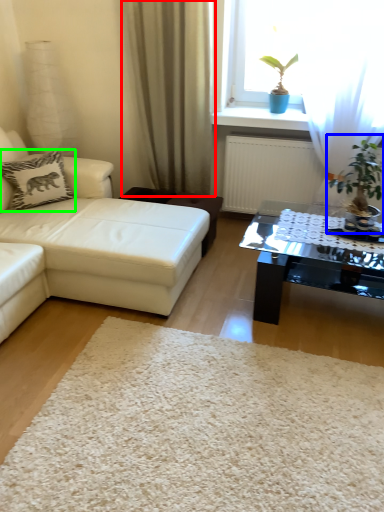
Question: Which object is positioned farthest from curtain (highlighted by a red box)? Select from houseplant (highlighted by a blue box) and pillow (highlighted by a green box).

Choices:
 (A) houseplant
 (B) pillow

Answer: (A)